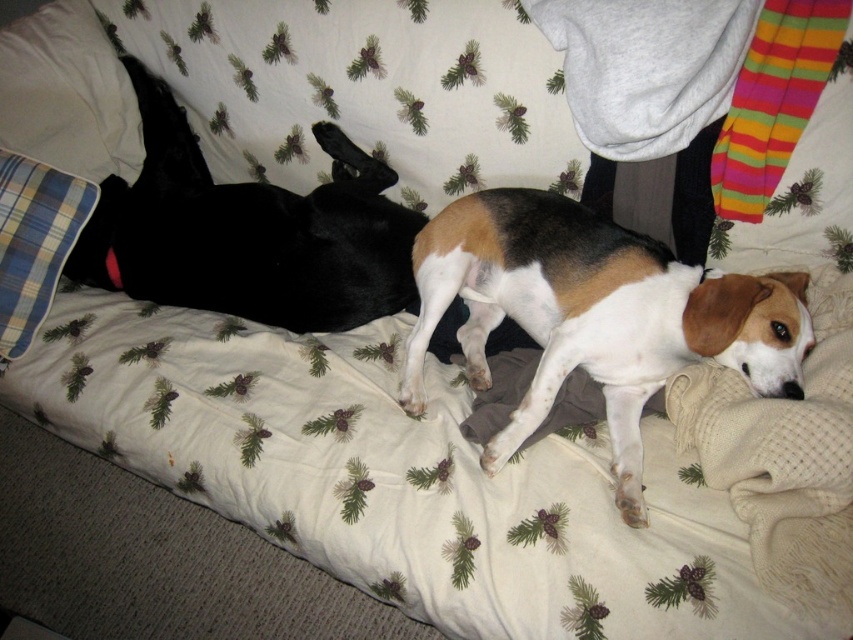
You are trying to place a new blanket on the bed. The black smooth dog at left is currently occupying some space. Can the blue plaid pillow at left fit entirely under the dog if you move it there?

The black smooth dog at left is wider than the blue plaid pillow at left, so the pillow can fit entirely under the dog since it is narrower.